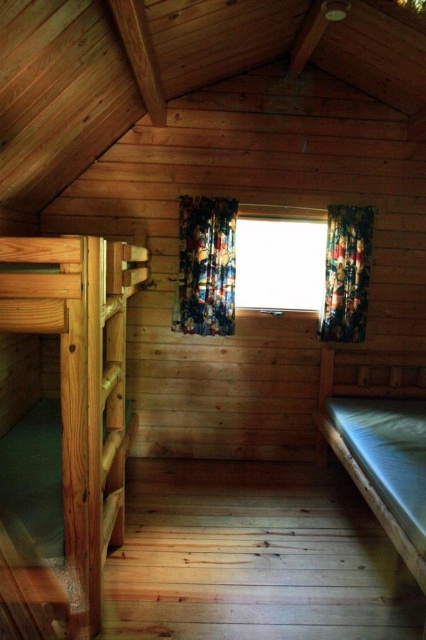
Question: Which object appears closest to the camera in this image?

Choices:
 (A) multicolored fabric curtain at center
 (B) natural wood bunk bed at left
 (C) white fabric bed at right
 (D) transparent glass window at center

Answer: (B)

Question: Which object is positioned closest to the white fabric bed at right?

Choices:
 (A) natural wood bunk bed at left
 (B) transparent glass window at center

Answer: (B)

Question: Which point is farther to the camera?

Choices:
 (A) multicolored fabric curtain at center
 (B) transparent glass window at center

Answer: (B)

Question: Is natural wood bunk bed at left to the left of multicolored fabric curtain at center from the viewer's perspective?

Choices:
 (A) yes
 (B) no

Answer: (A)

Question: Does natural wood bunk bed at left have a smaller size compared to transparent glass window at center?

Choices:
 (A) no
 (B) yes

Answer: (A)

Question: Can you confirm if transparent glass window at center is smaller than floral fabric curtain at right?

Choices:
 (A) no
 (B) yes

Answer: (A)